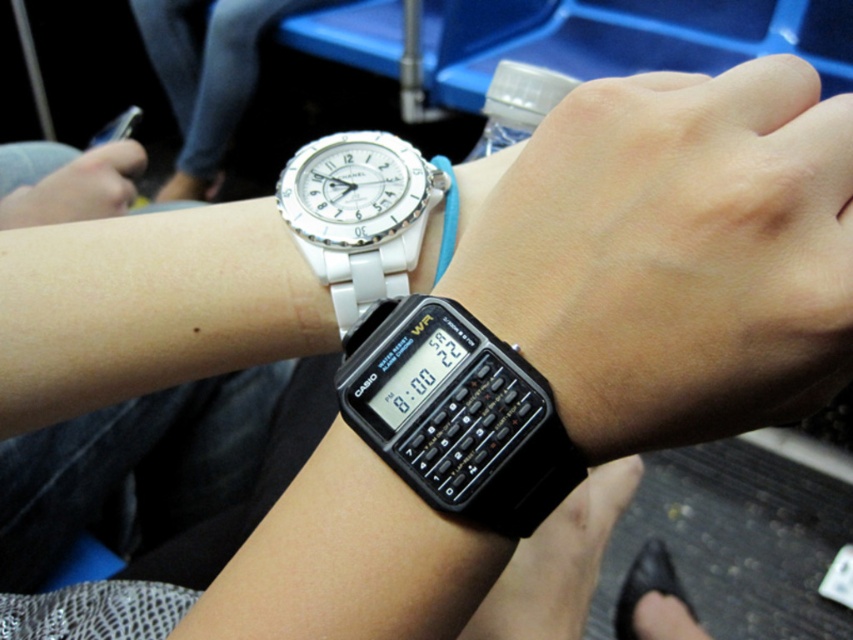
Can you confirm if black rubber watch at lower center is positioned above blue fabric strap at center?

Incorrect, black rubber watch at lower center is not positioned above blue fabric strap at center.

Is black rubber watch at lower center thinner than blue fabric strap at center?

In fact, black rubber watch at lower center might be wider than blue fabric strap at center.

Locate an element on the screen. Image resolution: width=853 pixels, height=640 pixels. black rubber watch at lower center is located at coordinates (675, 253).

In the scene shown: Between white ceramic watch at upper left and blue fabric strap at center, which one is positioned lower?

white ceramic watch at upper left is lower down.

Does white ceramic watch at upper left have a greater height compared to blue fabric strap at center?

Correct, white ceramic watch at upper left is much taller as blue fabric strap at center.

Is point (370, 240) closer to viewer compared to point (437, 170)?

That is True.

Find the location of `white ceramic watch at upper left`. white ceramic watch at upper left is located at coordinates (358, 214).

Does black plastic calculator at lower center have a smaller size compared to blue fabric strap at center?

Incorrect, black plastic calculator at lower center is not smaller in size than blue fabric strap at center.

You are a GUI agent. You are given a task and a screenshot of the screen. Output one action in this format:
    pyautogui.click(x=<x>, y=<y>)
    Task: Click on the black plastic calculator at lower center
    
    Given the screenshot: What is the action you would take?
    pyautogui.click(x=456, y=413)

Is point (363, 348) positioned after point (457, 212)?

That is False.

At what (x,y) coordinates should I click in order to perform the action: click on black plastic calculator at lower center. Please return your answer as a coordinate pair (x, y). Looking at the image, I should click on (456, 413).